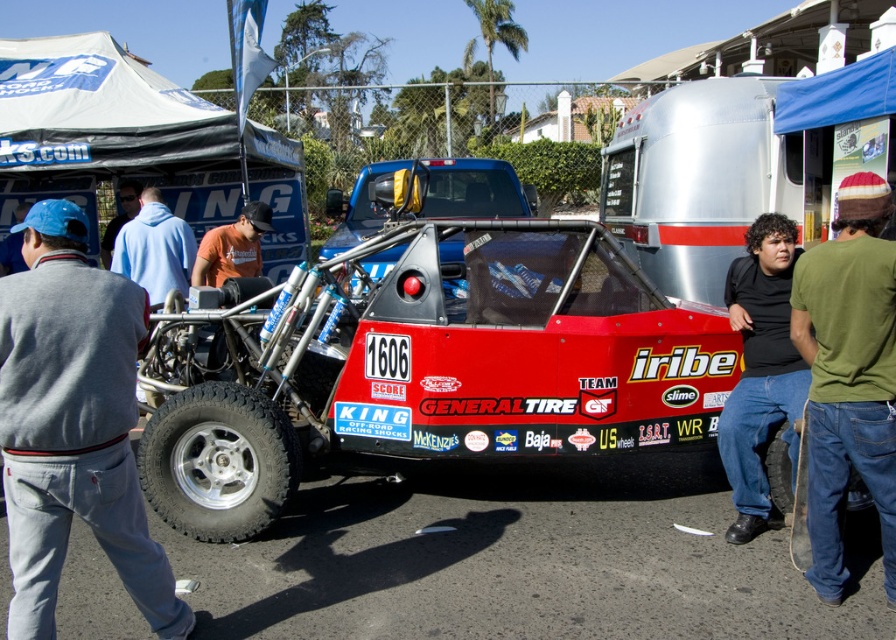
Question: Among these objects, which one is nearest to the camera?

Choices:
 (A) orange fabric shirt at center
 (B) black rubber tire at lower center
 (C) light blue denim jacket at left

Answer: (B)

Question: Is black rubber tire at lower left bigger than light blue denim jacket at left?

Choices:
 (A) yes
 (B) no

Answer: (B)

Question: Is black matte shirt at center thinner than light blue denim jacket at left?

Choices:
 (A) no
 (B) yes

Answer: (B)

Question: Which of these objects is positioned closest to the light blue denim jacket at left?

Choices:
 (A) black rubber tire at lower center
 (B) orange fabric shirt at center
 (C) black rubber tire at lower left
 (D) light blue hoodie at left

Answer: (D)

Question: Which point is closer to the camera?

Choices:
 (A) green knit cap at upper right
 (B) light blue denim jacket at left

Answer: (A)

Question: Is black rubber tire at lower left thinner than black matte shirt at center?

Choices:
 (A) yes
 (B) no

Answer: (B)